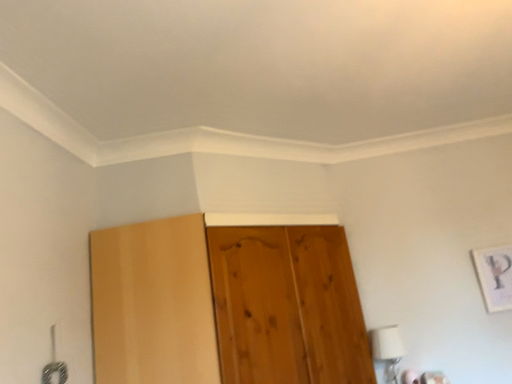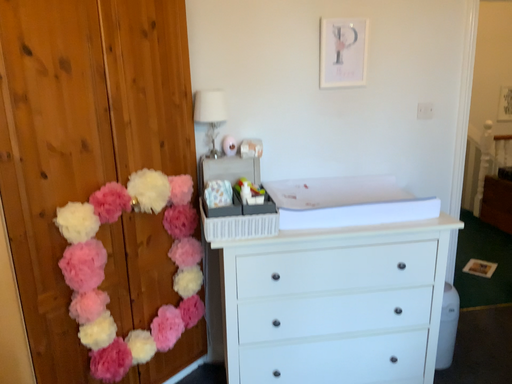
Question: How did the camera likely rotate when shooting the video?

Choices:
 (A) rotated right
 (B) rotated left

Answer: (A)